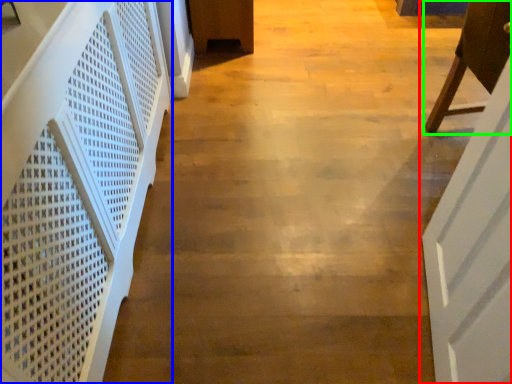
Question: Considering the real-world distances, which object is farthest from door (highlighted by a red box)? stairwell (highlighted by a blue box) or furniture (highlighted by a green box)?

Choices:
 (A) stairwell
 (B) furniture

Answer: (A)